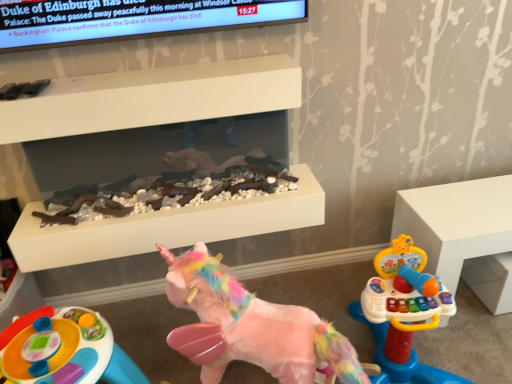
Locate an element on the screen. The image size is (512, 384). free point above white plastic toy at right (from a real-world perspective) is located at coordinates (475, 201).